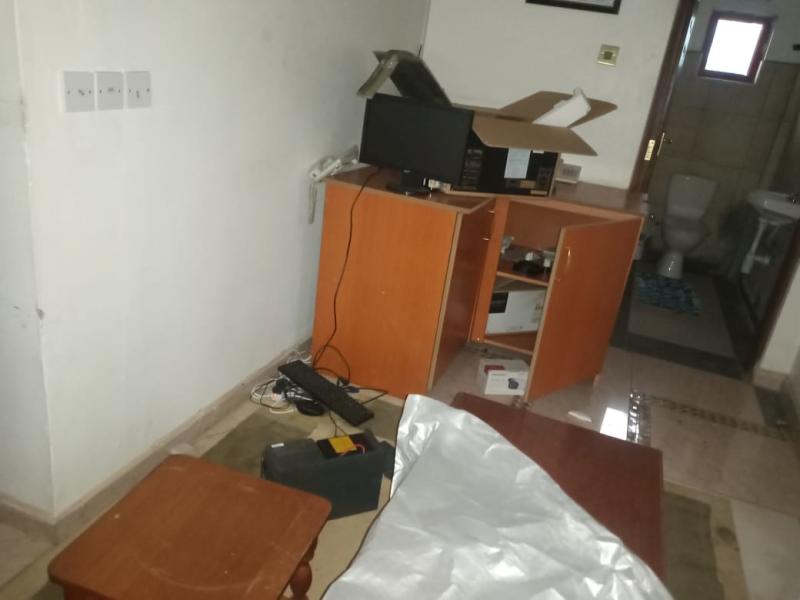
In order to click on wiring in this screenshot , I will do `click(282, 389)`, `click(332, 329)`.